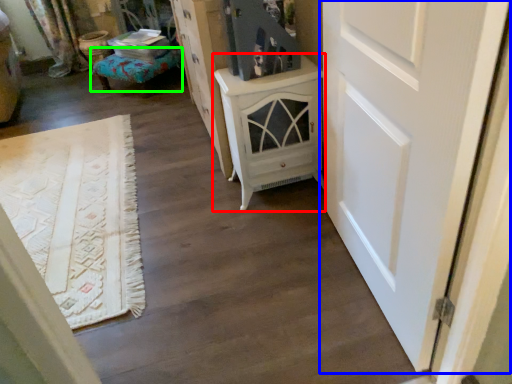
Question: Which object is the farthest from chest of drawers (highlighted by a red box)? Choose among these: door (highlighted by a blue box) or furniture (highlighted by a green box).

Choices:
 (A) door
 (B) furniture

Answer: (B)